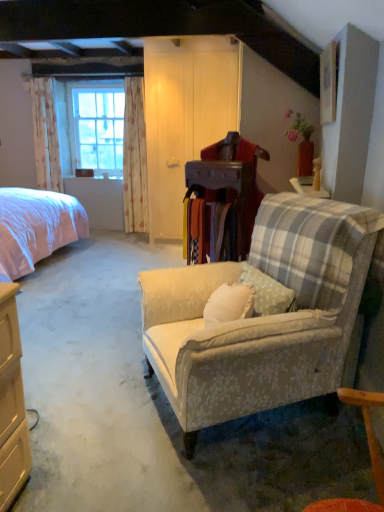
You are a GUI agent. You are given a task and a screenshot of the screen. Output one action in this format:
    pyautogui.click(x=<x>, y=<y>)
    Task: Click on the free space to the left of floral fabric armchair at center
    This screenshot has height=512, width=384.
    Given the screenshot: What is the action you would take?
    pyautogui.click(x=89, y=366)